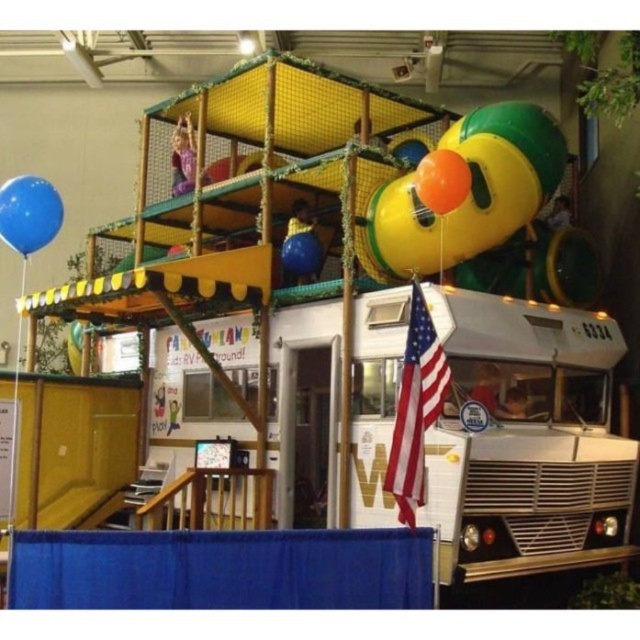
Question: Which object is closer to the camera taking this photo?

Choices:
 (A) orange rubber balloon at upper center
 (B) blue rubber balloon at center

Answer: (A)

Question: Which point appears closest to the camera in this image?

Choices:
 (A) (284, 266)
 (B) (508, 512)

Answer: (B)

Question: Does rubber duck balloon at upper right have a larger size compared to blue rubber balloon at center?

Choices:
 (A) no
 (B) yes

Answer: (B)

Question: Can you confirm if white metallic school bus at center is smaller than blue rubber balloon at left?

Choices:
 (A) yes
 (B) no

Answer: (B)

Question: Does white metallic school bus at center lie behind orange rubber balloon at upper center?

Choices:
 (A) no
 (B) yes

Answer: (A)

Question: Among these objects, which one is farthest from the camera?

Choices:
 (A) american flag at center
 (B) blue rubber balloon at center
 (C) blue rubber balloon at left

Answer: (B)